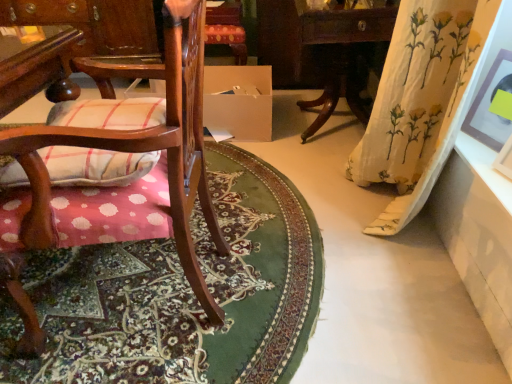
Identify the location of free region under white floral fabric curtain at right (from a real-world perspective). Image resolution: width=512 pixels, height=384 pixels. (399, 230).